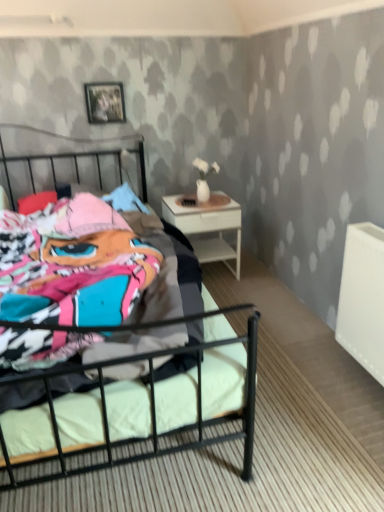
Question: Considering the positions of metallic black bed at center and white glossy nightstand at right in the image, is metallic black bed at center bigger or smaller than white glossy nightstand at right?

Choices:
 (A) big
 (B) small

Answer: (A)

Question: Considering their positions, is metallic black bed at center located in front of or behind white glossy nightstand at right?

Choices:
 (A) front
 (B) behind

Answer: (A)

Question: Which is farther from the white glossy nightstand at right?

Choices:
 (A) metallic black bed at center
 (B) metallic silver picture frame at upper center

Answer: (B)

Question: Which object is the farthest from the metallic silver picture frame at upper center?

Choices:
 (A) white glossy nightstand at right
 (B) metallic black bed at center

Answer: (B)